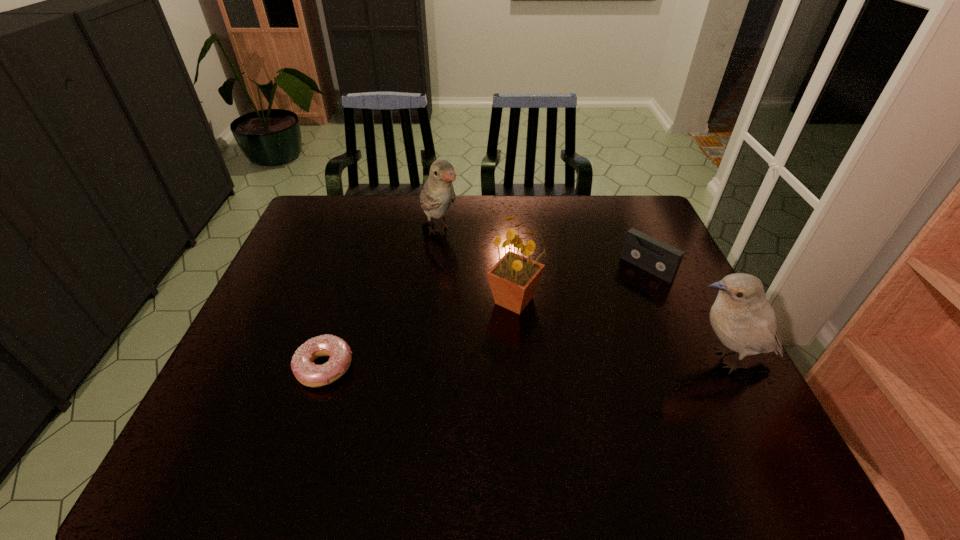
Locate an element on the screen. Image resolution: width=960 pixels, height=540 pixels. object positioned at the far edge is located at coordinates (438, 193).

The image size is (960, 540). What are the coordinates of `object that is at the near edge` in the screenshot? It's located at (309, 374).

Image resolution: width=960 pixels, height=540 pixels. Find the location of `object at the left edge`. object at the left edge is located at coordinates (309, 374).

In order to click on bird present at the right edge in this screenshot , I will do `click(742, 318)`.

At what (x,y) coordinates should I click in order to perform the action: click on videotape located at the right edge. Please return your answer as a coordinate pair (x, y). The height and width of the screenshot is (540, 960). Looking at the image, I should click on (640, 249).

Find the location of `object that is at the near left corner`. object that is at the near left corner is located at coordinates (309, 374).

The height and width of the screenshot is (540, 960). In the image, there is a desktop. Identify the location of free space at the far edge. (399, 226).

Where is `free space at the near edge`? free space at the near edge is located at coordinates (424, 419).

Image resolution: width=960 pixels, height=540 pixels. What are the coordinates of `vacant point at the left edge` in the screenshot? It's located at (295, 326).

The image size is (960, 540). In the image, there is a desktop. In order to click on vacant space at the right edge in this screenshot , I will do `click(675, 286)`.